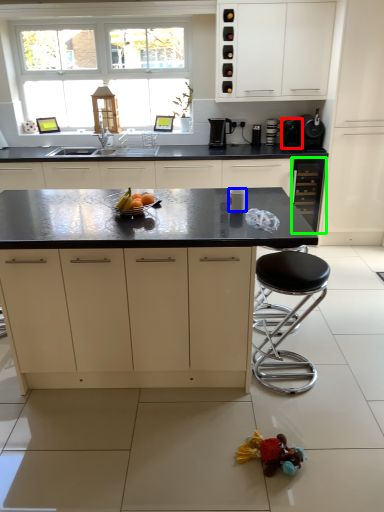
Question: Which object is positioned closest to appliance (highlighted by a red box)? Select from appliance (highlighted by a blue box) and cabinetry (highlighted by a green box).

Choices:
 (A) appliance
 (B) cabinetry

Answer: (B)